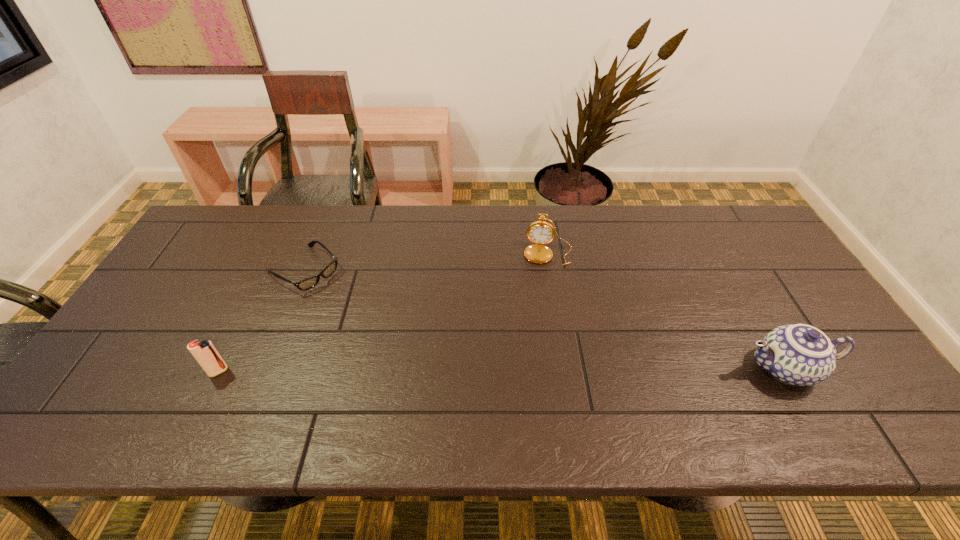
At what (x,y) coordinates should I click in order to perform the action: click on igniter. Please return your answer as a coordinate pair (x, y). This screenshot has height=540, width=960. Looking at the image, I should click on (205, 353).

Where is `chinaware`? The image size is (960, 540). chinaware is located at coordinates (801, 355).

Where is `the shortest object`? The image size is (960, 540). the shortest object is located at coordinates (308, 283).

At what (x,y) coordinates should I click in order to perform the action: click on the third object from left to right. Please return your answer as a coordinate pair (x, y). The height and width of the screenshot is (540, 960). Looking at the image, I should click on (540, 233).

This screenshot has width=960, height=540. What are the coordinates of `free space located 0.070m on the right of the igniter` in the screenshot? It's located at (255, 372).

The width and height of the screenshot is (960, 540). I want to click on free spot located 0.090m from the spout of the chinaware, so click(699, 368).

At what (x,y) coordinates should I click in order to perform the action: click on free spot located from the spout of the chinaware. Please return your answer as a coordinate pair (x, y). Looking at the image, I should click on (708, 368).

Find the location of a particular element. This screenshot has width=960, height=540. vacant point located from the spout of the chinaware is located at coordinates (576, 368).

Find the location of a particular element. The width and height of the screenshot is (960, 540). vacant space situated on the front-facing side of the spectacles is located at coordinates (405, 347).

Identify the location of vacant space located 0.230m on the front-facing side of the spectacles. click(379, 327).